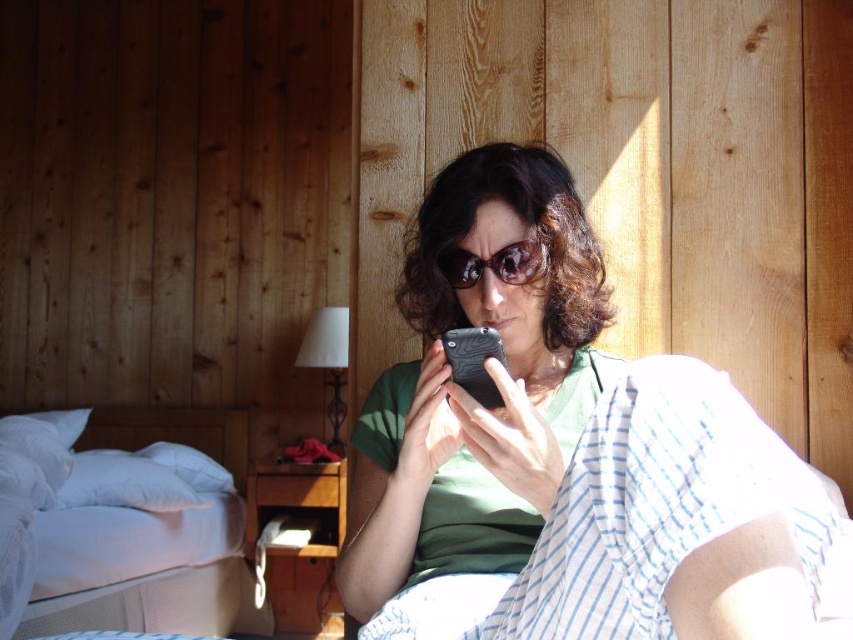
From the picture: You are standing at the center of the room and want to reach the white soft bed at lower left. According to the coordinates provided, in which direction should you move first?

The white soft bed at lower left is located at point (119, 545), which means it is positioned to the lower left of the room. To reach it from the center, you should move diagonally towards the lower left direction.

Looking at this image, you are taking a photo of the scene and want to focus on both the point at (503, 536) and the point at (490, 410). Which point should you adjust your focus to first to ensure both are sharp?

You should focus on point (490, 410) first because it is closer to the camera than point (503, 536). By focusing on the closer point, the further point will also be in focus due to the depth of field.

You are a photographer trying to capture the shiny brown sunglasses at center in the image. The camera you are using has a very narrow field of view. Where should you focus your camera to ensure the sunglasses are in the frame?

You should focus your camera at point (494, 264) to capture the shiny brown sunglasses at center since that is their exact location.